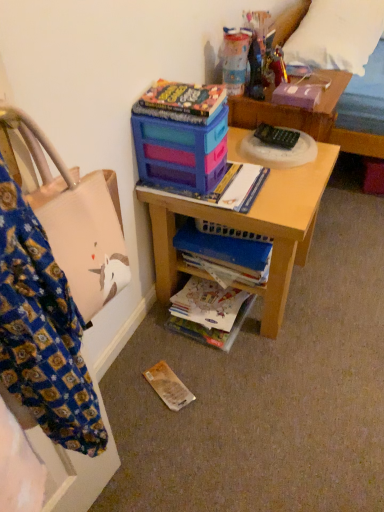
At what (x,y) coordinates should I click in order to perform the action: click on metallic gold figurine at upper center, which is the first toy in right-to-left order. Please return your answer as a coordinate pair (x, y). The width and height of the screenshot is (384, 512). Looking at the image, I should click on (277, 65).

Measure the distance between point (301, 33) and camera.

A distance of 6.50 feet exists between point (301, 33) and camera.

The image size is (384, 512). What do you see at coordinates (251, 230) in the screenshot? I see `wooden desk at center` at bounding box center [251, 230].

You are a GUI agent. You are given a task and a screenshot of the screen. Output one action in this format:
    pyautogui.click(x=<x>, y=<y>)
    Task: Click on the metallic gold figurine at upper center, positioned as the second toy in left-to-right order
    
    Given the screenshot: What is the action you would take?
    pyautogui.click(x=277, y=65)

Does white soft pillow at upper right contain metallic gold figurine at upper center, positioned as the second toy in left-to-right order?

No, metallic gold figurine at upper center, positioned as the second toy in left-to-right order, is not inside white soft pillow at upper right.

How different are the orientations of white soft pillow at upper right and metallic gold figurine at upper center, which is the first toy in right-to-left order, in degrees?

The angular difference between white soft pillow at upper right and metallic gold figurine at upper center, which is the first toy in right-to-left order, is 1.5 degrees.

Could you tell me if white soft pillow at upper right is turned towards metallic gold figurine at upper center, which is the first toy in right-to-left order?

No.

Consider the image. Looking at their sizes, would you say white soft pillow at upper right is wider or thinner than metallic gold figurine at upper center, which is the first toy in right-to-left order?

white soft pillow at upper right is wider than metallic gold figurine at upper center, which is the first toy in right-to-left order.

Who is taller, matte plastic magazine at center or wooden desk at center?

wooden desk at center is taller.

From the image's perspective, is matte plastic magazine at center over wooden desk at center?

Yes, from the image's perspective, matte plastic magazine at center is above wooden desk at center.

Is matte plastic magazine at center closer to the viewer compared to wooden desk at center?

No, matte plastic magazine at center is further to the viewer.

Can you tell me how much matte plastic magazine at center and wooden desk at center differ in facing direction?

There is a 1.19-degree angle between the facing directions of matte plastic magazine at center and wooden desk at center.

Does hardcover book at upper center, which is counted as the 1th paperback book, starting from the front, have a larger size compared to black plastic remote control at center?

Yes.

Is hardcover book at upper center, which ranks as the 2th paperback book in bottom-to-top order, to the left or to the right of black plastic remote control at center in the image?

In the image, hardcover book at upper center, which ranks as the 2th paperback book in bottom-to-top order, appears on the left side of black plastic remote control at center.

Between hardcover book at upper center, the second paperback book viewed from the right, and black plastic remote control at center, which one is positioned behind?

black plastic remote control at center.

Which is behind, point (217, 102) or point (258, 136)?

The point (258, 136) is farther.

Is matte plastic toy box at upper center facing away from black plastic remote control at center?

No, matte plastic toy box at upper center's orientation is not away from black plastic remote control at center.

How many degrees apart are the facing directions of matte plastic toy box at upper center and black plastic remote control at center?

matte plastic toy box at upper center and black plastic remote control at center are facing 2.25 degrees away from each other.

Can you confirm if matte plastic toy box at upper center is bigger than black plastic remote control at center?

Yes, matte plastic toy box at upper center is bigger than black plastic remote control at center.

Considering the sizes of objects matte plastic toy box at upper center and metallic gold figurine at upper center, which is the first toy in right-to-left order, in the image provided, who is taller, matte plastic toy box at upper center or metallic gold figurine at upper center, which is the first toy in right-to-left order,?

matte plastic toy box at upper center.

Which of these two, matte plastic toy box at upper center or metallic gold figurine at upper center, positioned as the second toy in left-to-right order, is bigger?

With larger size is matte plastic toy box at upper center.

This screenshot has width=384, height=512. Identify the location of box that appears below the metallic gold figurine at upper center, positioned as the second toy in left-to-right order (from the image's perspective). (181, 151).

Between matte plastic toy box at upper center and matte paper book at lower center, which is the 2th book from top to bottom, which one has less height?

matte paper book at lower center, which is the 2th book from top to bottom.

Is matte plastic toy box at upper center thinner than matte paper book at lower center, which appears as the first book when ordered from the bottom?

Yes, matte plastic toy box at upper center is thinner than matte paper book at lower center, which appears as the first book when ordered from the bottom.

Does matte plastic toy box at upper center turn towards matte paper book at lower center, which appears as the first book when ordered from the bottom?

No, matte plastic toy box at upper center is not facing towards matte paper book at lower center, which appears as the first book when ordered from the bottom.

Can you confirm if matte plastic toy box at upper center is positioned to the left of matte paper book at lower center, which is the 2th book from top to bottom?

Correct, you'll find matte plastic toy box at upper center to the left of matte paper book at lower center, which is the 2th book from top to bottom.

What's the angular difference between translucent plastic container at upper center, the 1th toy in the left-to-right sequence, and matte plastic magazine at center's facing directions?

translucent plastic container at upper center, the 1th toy in the left-to-right sequence, and matte plastic magazine at center are facing 3.87 degrees away from each other.

Considering the sizes of objects translucent plastic container at upper center, marked as the second toy in a right-to-left arrangement, and matte plastic magazine at center in the image provided, who is shorter, translucent plastic container at upper center, marked as the second toy in a right-to-left arrangement, or matte plastic magazine at center?

matte plastic magazine at center.

Is point (229, 74) positioned in front of point (164, 188)?

No.

From the picture: Is translucent plastic container at upper center, the 1th toy in the left-to-right sequence, positioned beyond the bounds of matte plastic magazine at center?

Indeed, translucent plastic container at upper center, the 1th toy in the left-to-right sequence, is completely outside matte plastic magazine at center.

From a real-world perspective, count 1st toys upward from the white soft pillow at upper right and point to it. Please provide its 2D coordinates.

[(277, 65)]

In order to click on magazine that is behind the wooden desk at center in this screenshot , I will do `click(221, 188)`.

From the image, which object appears to be nearer to wooden bed at upper right, black plastic remote control at center or metallic gold figurine at upper center, which is the first toy in right-to-left order?

metallic gold figurine at upper center, which is the first toy in right-to-left order.

When comparing their distances from matte plastic magazine at center, does metallic gold figurine at upper center, positioned as the second toy in left-to-right order, or white soft pillow at upper right seem further?

white soft pillow at upper right is positioned further to the anchor matte plastic magazine at center.

Estimate the real-world distances between objects in this image. Which object is closer to white soft pillow at upper right, translucent plastic container at upper center, the 1th toy in the left-to-right sequence, or metallic gold figurine at upper center, positioned as the second toy in left-to-right order?

metallic gold figurine at upper center, positioned as the second toy in left-to-right order.

From the image, which object appears to be nearer to black plastic remote control at center, hardcover book at upper center, the 2th paperback book positioned from the top, or matte plastic toy box at upper center?

matte plastic toy box at upper center is closer to black plastic remote control at center.

Looking at the image, which one is located further to hardcover book at upper right, the 1th paperback book in the top-to-bottom sequence, translucent plastic container at upper center, the 1th toy in the left-to-right sequence, or metallic gold figurine at upper center, which is the first toy in right-to-left order?

Based on the image, translucent plastic container at upper center, the 1th toy in the left-to-right sequence, appears to be further to hardcover book at upper right, the 1th paperback book in the top-to-bottom sequence.

When comparing their distances from black plastic remote control at center, does wooden desk at center or wooden bed at upper right seem closer?

wooden desk at center.

Estimate the real-world distances between objects in this image. Which object is closer to matte plastic toy box at upper center, wooden desk at center or matte paper book at lower center, which appears as the first book when ordered from the bottom?

Among the two, wooden desk at center is located nearer to matte plastic toy box at upper center.

When comparing their distances from matte paper book at lower center, which is the 2th book from top to bottom, does translucent plastic container at upper center, the 1th toy in the left-to-right sequence, or matte plastic magazine at center seem further?

translucent plastic container at upper center, the 1th toy in the left-to-right sequence, lies further to matte paper book at lower center, which is the 2th book from top to bottom, than the other object.

Find the location of `pillow between translucent plastic container at upper center, the 1th toy in the left-to-right sequence, and wooden bed at upper right`. pillow between translucent plastic container at upper center, the 1th toy in the left-to-right sequence, and wooden bed at upper right is located at coordinates (337, 35).

Locate an element on the screen. This screenshot has height=512, width=384. remote control between matte plastic magazine at center and wooden bed at upper right in the horizontal direction is located at coordinates (277, 136).

Identify the location of pillow situated between metallic gold figurine at upper center, which is the first toy in right-to-left order, and wooden bed at upper right from left to right. (337, 35).

The image size is (384, 512). I want to click on paperback book located between hardcover book at upper center, which ranks as the 2th paperback book in bottom-to-top order, and wooden bed at upper right in the left-right direction, so click(x=297, y=95).